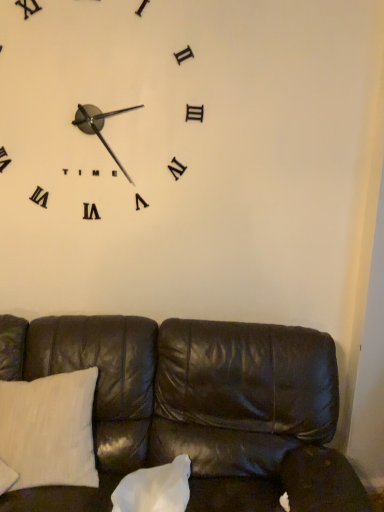
Question: Which direction should I rotate to face white matte pillow at center, the second pillow positioned from the left, — up or down?

Choices:
 (A) down
 (B) up

Answer: (A)

Question: Can you confirm if leather couch at lower center is thinner than white matte pillow at center, the second pillow positioned from the left?

Choices:
 (A) yes
 (B) no

Answer: (B)

Question: Could you tell me if leather couch at lower center is turned towards white matte pillow at center, which is the 1th pillow in right-to-left order?

Choices:
 (A) no
 (B) yes

Answer: (B)

Question: From a real-world perspective, is leather couch at lower center physically below white matte pillow at center, the second pillow positioned from the left?

Choices:
 (A) yes
 (B) no

Answer: (B)

Question: Considering the relative sizes of leather couch at lower center and white matte pillow at center, which is the 1th pillow in right-to-left order, in the image provided, is leather couch at lower center shorter than white matte pillow at center, which is the 1th pillow in right-to-left order,?

Choices:
 (A) no
 (B) yes

Answer: (A)

Question: Is leather couch at lower center taller than white matte pillow at center, which is the 1th pillow in right-to-left order?

Choices:
 (A) no
 (B) yes

Answer: (B)

Question: Is leather couch at lower center wider than white matte pillow at center, the second pillow positioned from the left?

Choices:
 (A) yes
 (B) no

Answer: (A)

Question: Considering the relative positions of leather couch at lower center and white cotton pillow at lower left, the 2th pillow in the right-to-left sequence, in the image provided, is leather couch at lower center behind white cotton pillow at lower left, the 2th pillow in the right-to-left sequence,?

Choices:
 (A) yes
 (B) no

Answer: (B)

Question: Does leather couch at lower center appear on the left side of white cotton pillow at lower left, the 2th pillow in the right-to-left sequence?

Choices:
 (A) no
 (B) yes

Answer: (A)

Question: Is leather couch at lower center shorter than white cotton pillow at lower left, marked as the 1th pillow in a left-to-right arrangement?

Choices:
 (A) no
 (B) yes

Answer: (A)

Question: Could you tell me if leather couch at lower center is facing white cotton pillow at lower left, the 2th pillow in the right-to-left sequence?

Choices:
 (A) no
 (B) yes

Answer: (B)

Question: From the image's perspective, is leather couch at lower center under white cotton pillow at lower left, the 2th pillow in the right-to-left sequence?

Choices:
 (A) yes
 (B) no

Answer: (A)

Question: From a real-world perspective, is leather couch at lower center physically below white cotton pillow at lower left, the 2th pillow in the right-to-left sequence?

Choices:
 (A) no
 (B) yes

Answer: (B)

Question: Is white cotton pillow at lower left, marked as the 1th pillow in a left-to-right arrangement, bigger than leather couch at lower center?

Choices:
 (A) yes
 (B) no

Answer: (B)